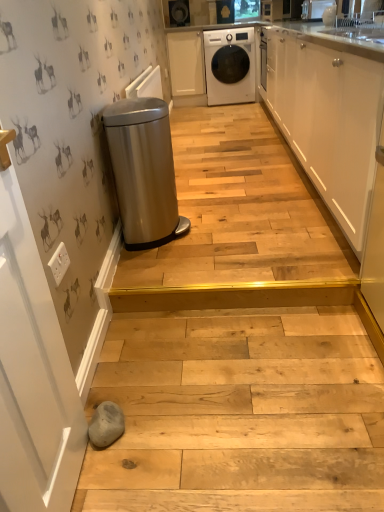
Question: Can you confirm if white glossy cabinet at upper right, which is the first cabinetry from right to left, is shorter than stainless steel trash can at left?

Choices:
 (A) yes
 (B) no

Answer: (B)

Question: From a real-world perspective, is white glossy cabinet at upper right, arranged as the second cabinetry when viewed from the top, physically above stainless steel trash can at left?

Choices:
 (A) yes
 (B) no

Answer: (A)

Question: Is white glossy cabinet at upper right, the first cabinetry positioned from the front, at the right side of stainless steel trash can at left?

Choices:
 (A) yes
 (B) no

Answer: (A)

Question: Can stainless steel trash can at left be found inside white glossy cabinet at upper right, which ranks as the first cabinetry in bottom-to-top order?

Choices:
 (A) yes
 (B) no

Answer: (B)

Question: Is white glossy cabinet at upper right, acting as the 2th cabinetry starting from the back, facing towards stainless steel trash can at left?

Choices:
 (A) no
 (B) yes

Answer: (B)

Question: From the image's perspective, is stainless steel trash can at left above or below white glossy vase at upper center?

Choices:
 (A) above
 (B) below

Answer: (B)

Question: Looking at the image, does stainless steel trash can at left seem bigger or smaller compared to white glossy vase at upper center?

Choices:
 (A) small
 (B) big

Answer: (B)

Question: Is stainless steel trash can at left in front of or behind white glossy vase at upper center in the image?

Choices:
 (A) front
 (B) behind

Answer: (A)

Question: In the image, is stainless steel trash can at left on the left side or the right side of white glossy vase at upper center?

Choices:
 (A) left
 (B) right

Answer: (A)

Question: From a real-world perspective, is white glossy cabinet at upper right, which ranks as the first cabinetry in bottom-to-top order, above or below white glossy washing machine at upper center?

Choices:
 (A) below
 (B) above

Answer: (B)

Question: Is white glossy cabinet at upper right, acting as the 2th cabinetry starting from the back, inside the boundaries of white glossy washing machine at upper center, or outside?

Choices:
 (A) outside
 (B) inside

Answer: (A)

Question: In terms of height, does white glossy cabinet at upper right, which is the first cabinetry from right to left, look taller or shorter compared to white glossy washing machine at upper center?

Choices:
 (A) short
 (B) tall

Answer: (B)

Question: Is point (354, 210) closer or farther from the camera than point (241, 53)?

Choices:
 (A) farther
 (B) closer

Answer: (B)

Question: Is point (314, 0) positioned closer to the camera than point (147, 234)?

Choices:
 (A) closer
 (B) farther

Answer: (B)

Question: Considering the relative positions of white glossy vase at upper center and stainless steel trash can at left in the image provided, is white glossy vase at upper center to the left or to the right of stainless steel trash can at left?

Choices:
 (A) left
 (B) right

Answer: (B)